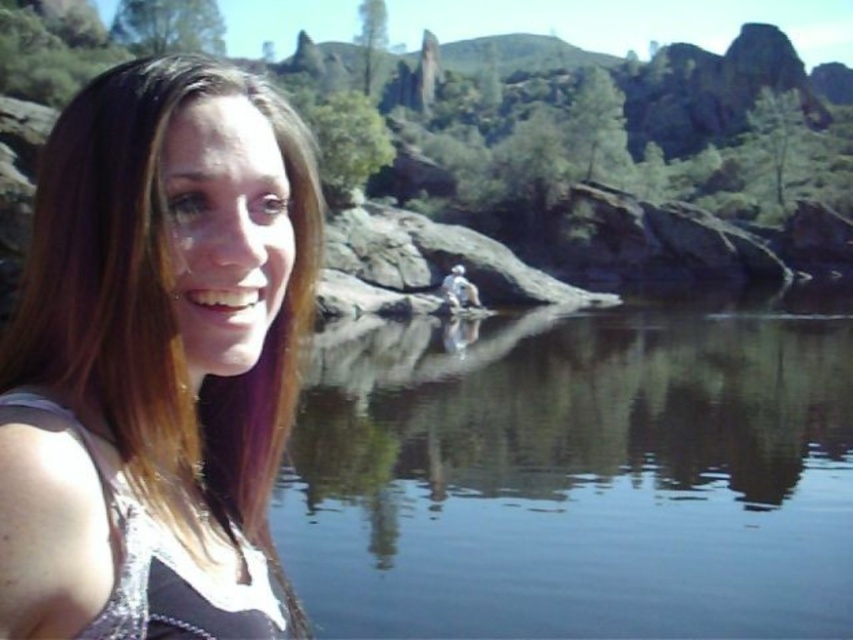
You are a photographer trying to capture the reflection of the water in the background. You notice the shiny silver tank top at left and the white matte person at center are blocking your view. Which object is wider and might be more obstructive to your shot?

The shiny silver tank top at left is wider than the white matte person at center, so it might be more obstructive to your shot.

You are a photographer trying to capture the clear water at center and the shiny silver tank top at left in the same frame. Based on their distance, will you need to adjust your camera focus to ensure both are in focus?

The clear water at center is 98.83 feet away from the shiny silver tank top at left. To ensure both are in focus, you need to adjust your camera focus to a point that accommodates this distance, likely using a smaller aperture for a deeper depth of field.

You are standing in the scene and want to take a photo of the clear water at center without the white matte person at center appearing in the shot. How can you adjust your position to achieve this?

Since the clear water at center is in front of the white matte person at center, you can move your position to directly face the clear water at center while stepping forward slightly to ensure the white matte person at center is out of the frame behind you.